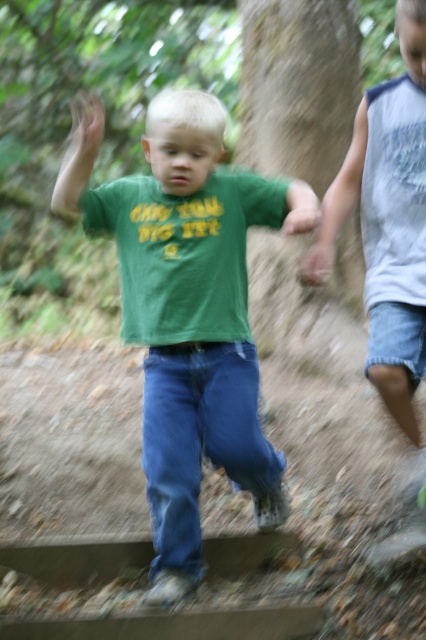
Question: Which of the following is the closest to the observer?

Choices:
 (A) (192, 180)
 (B) (322, 236)

Answer: (A)

Question: Observing the image, what is the correct spatial positioning of green matte shirt at center in reference to gray sleeveless shirt at right?

Choices:
 (A) left
 (B) right

Answer: (A)

Question: Is green matte shirt at center positioned before gray sleeveless shirt at right?

Choices:
 (A) yes
 (B) no

Answer: (A)

Question: Which object appears closest to the camera in this image?

Choices:
 (A) gray sleeveless shirt at right
 (B) green matte shirt at center

Answer: (B)

Question: Which of the following is the farthest from the observer?

Choices:
 (A) (359, 120)
 (B) (236, 464)

Answer: (A)

Question: Does green matte shirt at center appear under gray sleeveless shirt at right?

Choices:
 (A) yes
 (B) no

Answer: (A)